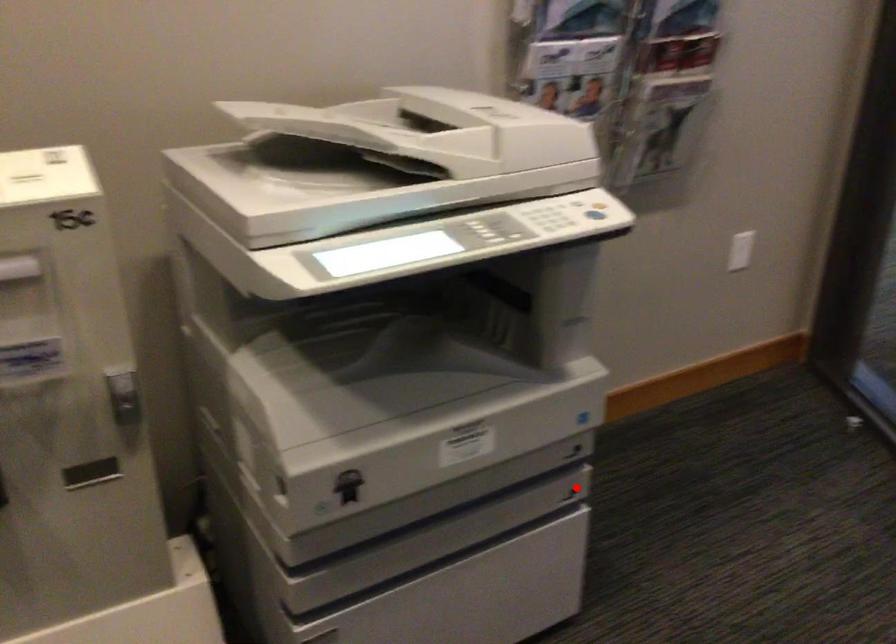
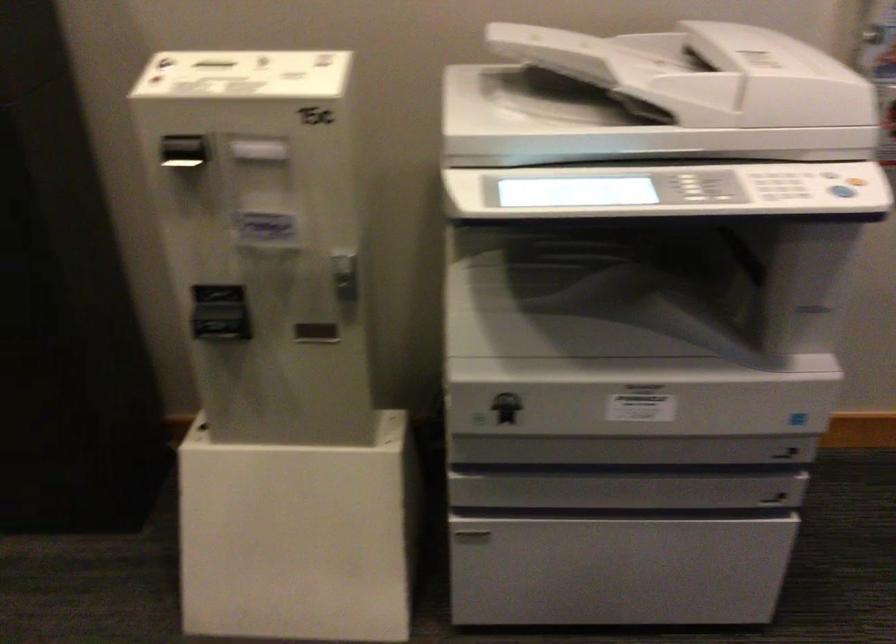
Question: I am providing you with two images of the same scene from different viewpoints. A red point is shown in image1. For the corresponding object point in image2, is it positioned nearer or farther from the camera?

Choices:
 (A) Nearer
 (B) Farther

Answer: (A)